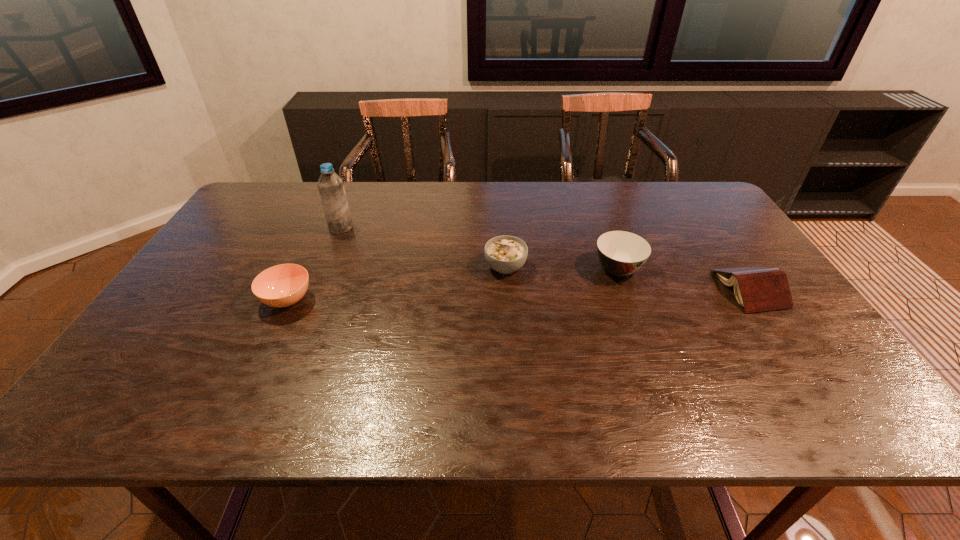
Find the location of a particular element. free point located on the back of the book is located at coordinates (686, 195).

Find the location of `object at the right edge`. object at the right edge is located at coordinates (757, 289).

This screenshot has height=540, width=960. In order to click on free space at the far edge in this screenshot , I will do `click(668, 216)`.

Find the location of a particular element. vacant space at the near edge is located at coordinates (415, 394).

At what (x,y) coordinates should I click in order to perform the action: click on blank space at the right edge. Please return your answer as a coordinate pair (x, y). The height and width of the screenshot is (540, 960). Looking at the image, I should click on (735, 237).

The height and width of the screenshot is (540, 960). Find the location of `vacant space at the far left corner`. vacant space at the far left corner is located at coordinates (292, 202).

Locate an element on the screen. This screenshot has width=960, height=540. free spot between the rightmost soup bowl and the second soup bowl from left to right is located at coordinates (562, 268).

Identify the location of free spot between the rightmost object and the fourth object from left to right. This screenshot has width=960, height=540. (684, 279).

Find the location of a particular element. The image size is (960, 540). vacant area that lies between the tallest object and the leftmost soup bowl is located at coordinates (314, 264).

At what (x,y) coordinates should I click in order to perform the action: click on blank region between the rightmost object and the second soup bowl from right to left. Please return your answer as a coordinate pair (x, y). Looking at the image, I should click on (628, 278).